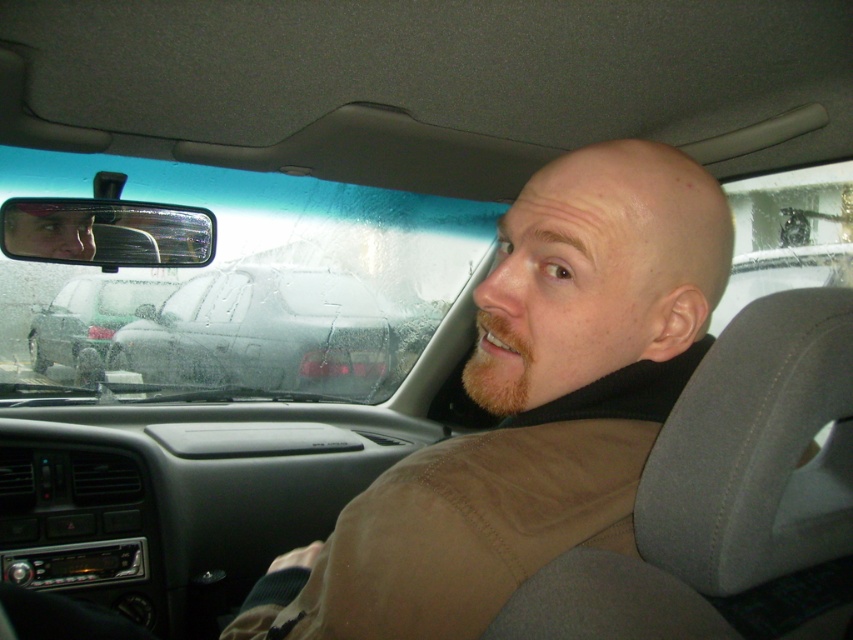
You are a passenger in a car and you notice two items at the center of your view. One is the brown cotton shirt at center and the other is the wet glass windshield at center. Which object takes up more space in your field of view?

The wet glass windshield at center takes up more space in your field of view because the brown cotton shirt at center is smaller than the wet glass windshield at center.

You are a passenger in a car and notice two objects through the windshield. The wet glass windshield at center and the smokey gray car at center. Which object appears bigger to you?

The wet glass windshield at center appears larger than the smokey gray car at center because it is described as larger in size.